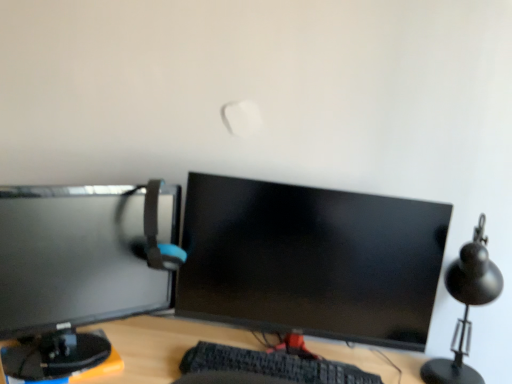
Question: Do you think black matte table lamp at right is within matte black monitor at center, marked as the 1th computer monitor in a right-to-left arrangement, or outside of it?

Choices:
 (A) outside
 (B) inside

Answer: (A)

Question: Considering the positions of black matte table lamp at right and matte black monitor at center, marked as the 1th computer monitor in a right-to-left arrangement, in the image, is black matte table lamp at right bigger or smaller than matte black monitor at center, marked as the 1th computer monitor in a right-to-left arrangement,?

Choices:
 (A) small
 (B) big

Answer: (A)

Question: Based on their relative distances, which object is farther from the black textured keyboard at center?

Choices:
 (A) black matte table lamp at right
 (B) matte black monitor at center, marked as the 1th computer monitor in a right-to-left arrangement
 (C) matte black monitor at left, the second computer monitor in the right-to-left sequence
 (D) matte gray computer chair at left

Answer: (A)

Question: Which object is positioned closest to the black textured keyboard at center?

Choices:
 (A) matte gray computer chair at left
 (B) matte black monitor at center, the 2th computer monitor positioned from the left
 (C) matte black monitor at left, arranged as the first computer monitor when viewed from the left
 (D) black matte table lamp at right

Answer: (B)